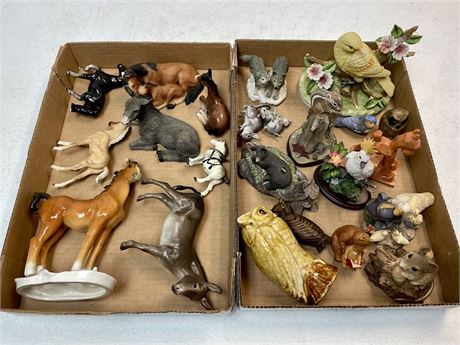
At what (x,y) coordinates should I click in order to perform the action: click on white surface. Please return your answer as a coordinate pair (x, y). The width and height of the screenshot is (460, 345). Looking at the image, I should click on (53, 20).